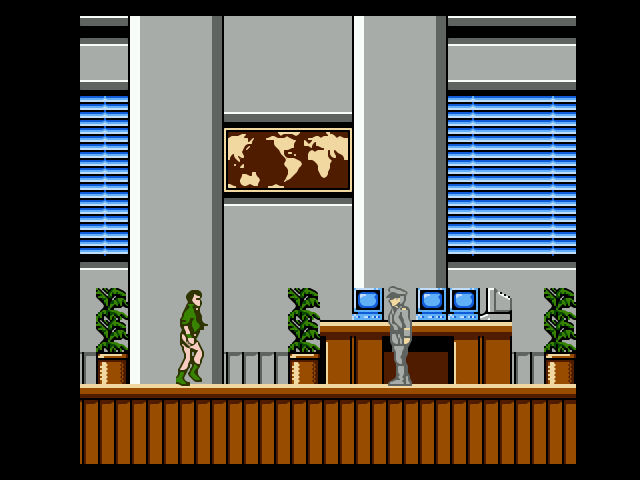
What are the coordinates of `plant pot` in the screenshot? It's located at (x=114, y=372), (x=306, y=374), (x=559, y=373).